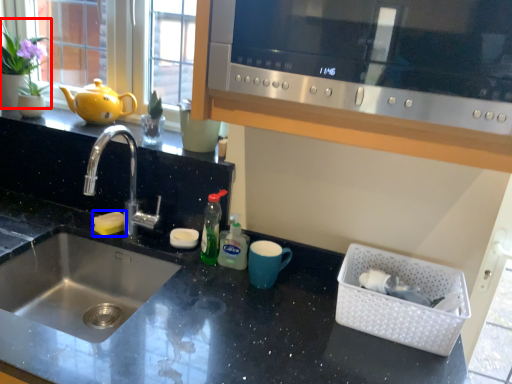
Question: Among these objects, which one is nearest to the camera, plant (highlighted by a red box) or food (highlighted by a blue box)?

Choices:
 (A) plant
 (B) food

Answer: (B)